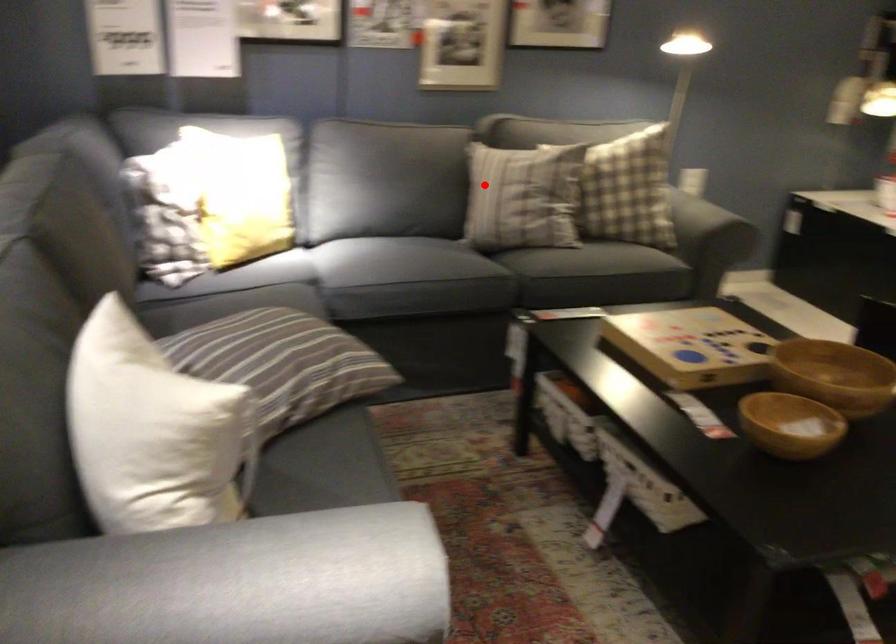
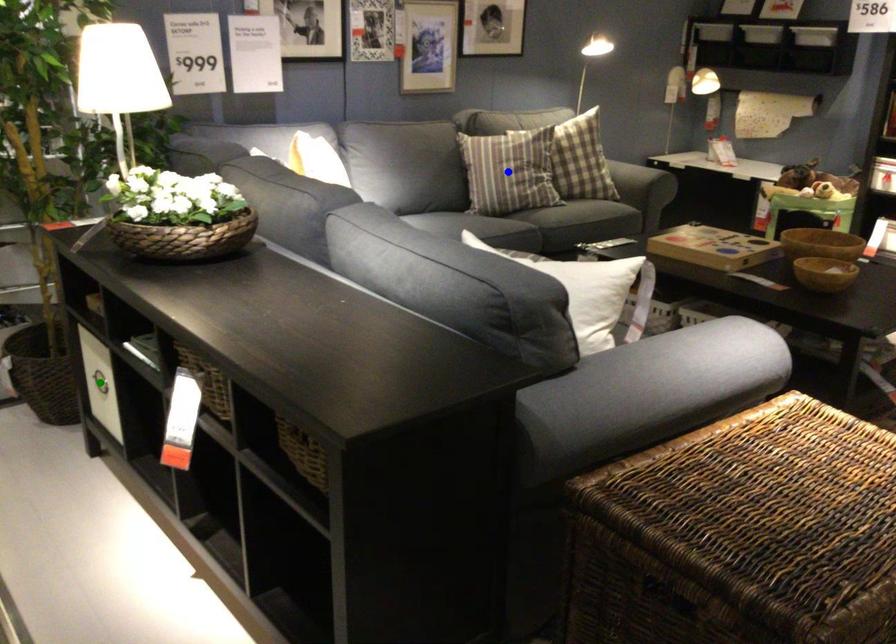
Question: I am providing you with two images of the same scene from different viewpoints. A red point is marked on the first image. You are given multiple points on the second image. Can you choose the point in image 2 that corresponds to the point in image 1?

Choices:
 (A) yellow point
 (B) blue point
 (C) green point

Answer: (B)